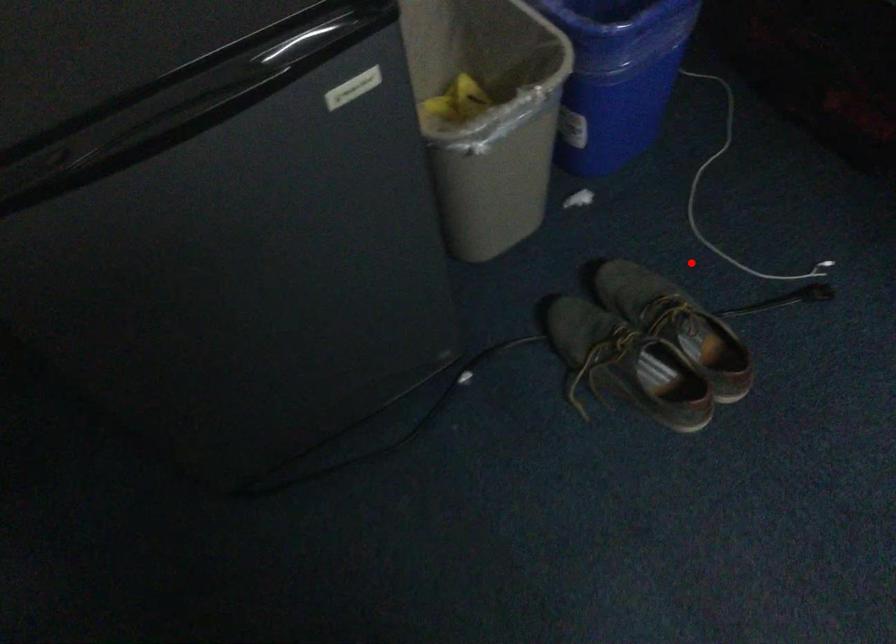
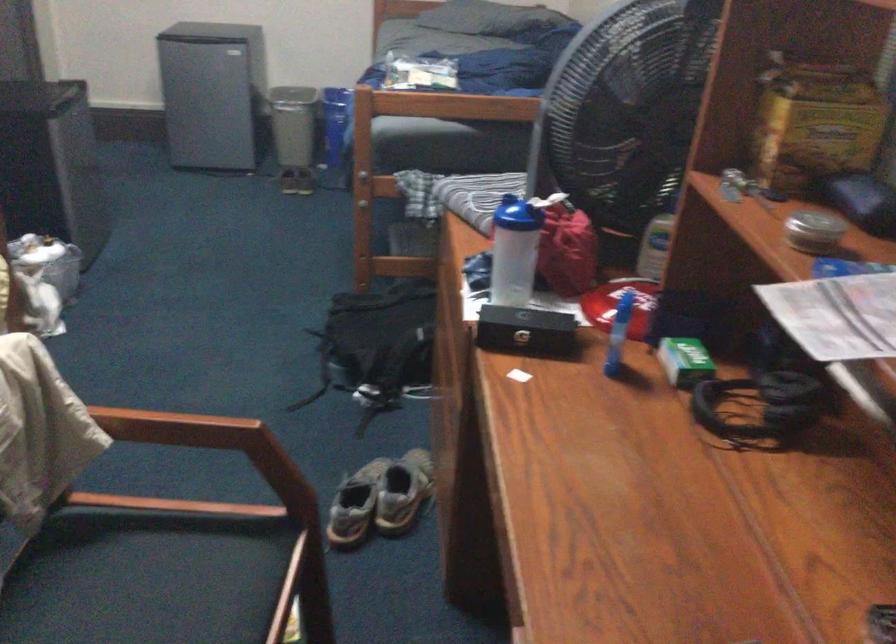
Question: I am providing you with two images of the same scene from different viewpoints. A red point is shown in image1. For the corresponding object point in image2, is it positioned nearer or farther from the camera?

Choices:
 (A) Nearer
 (B) Farther

Answer: (B)